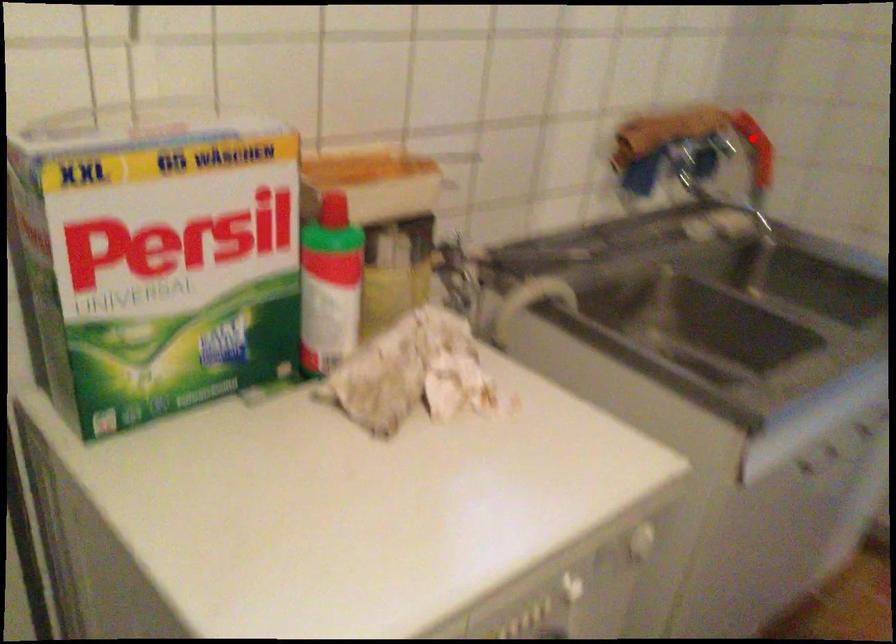
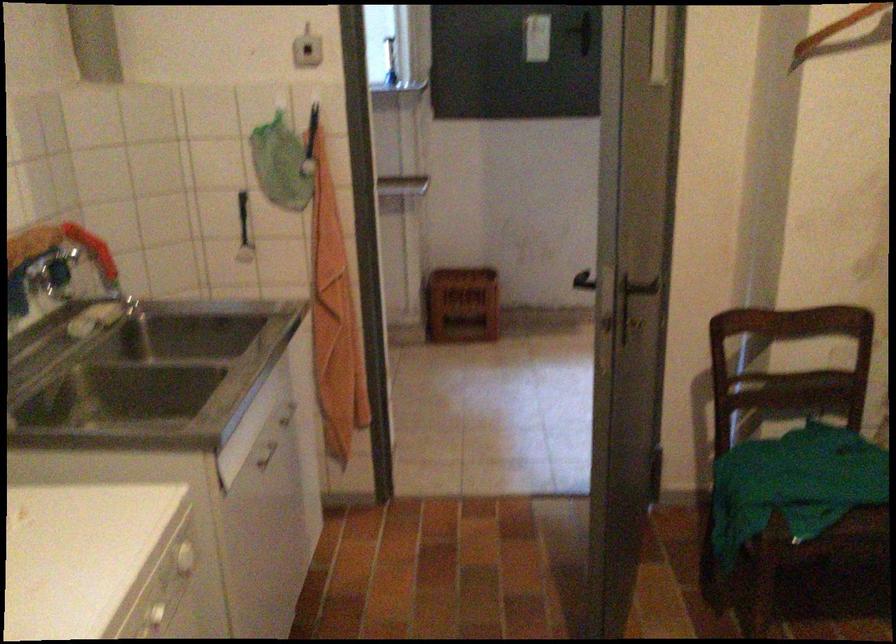
Question: A red point is marked in image1. In image2, is the corresponding 3D point closer to the camera or farther? Reply with the corresponding letter.

Choices:
 (A) The corresponding 3D point is closer.
 (B) The corresponding 3D point is farther.

Answer: (B)